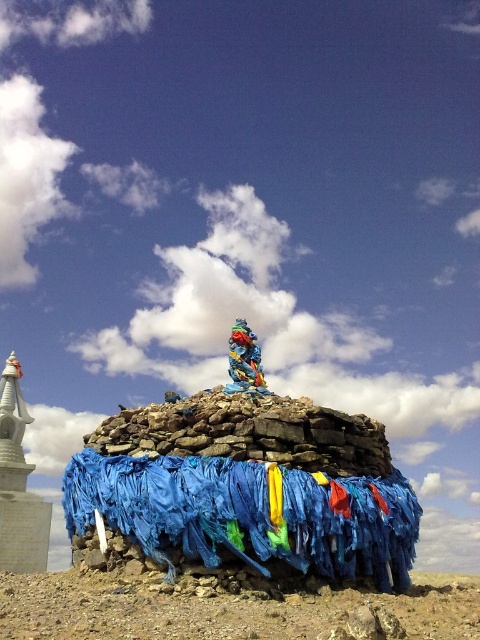
Can you confirm if blue fabric at center is shorter than white glossy stupa at left?

Yes, blue fabric at center is shorter than white glossy stupa at left.

This screenshot has height=640, width=480. Find the location of `blue fabric at center`. blue fabric at center is located at coordinates (248, 513).

Does point (204, 499) lie in front of point (3, 403)?

Yes.

Locate an element on the screen. The image size is (480, 640). blue fabric at center is located at coordinates (248, 513).

Is point (9, 444) more distant than point (233, 365)?

That is True.

Is white glossy stupa at left behind multicolored painted statue at center?

That is True.

Is point (6, 429) closer to viewer compared to point (250, 342)?

That is False.

What are the coordinates of `white glossy stupa at left` in the screenshot? It's located at (12, 413).

Is blue fabric at center smaller than multicolored painted statue at center?

Incorrect, blue fabric at center is not smaller in size than multicolored painted statue at center.

Can you confirm if blue fabric at center is shorter than multicolored painted statue at center?

Incorrect, blue fabric at center's height does not fall short of multicolored painted statue at center's.

Who is more distant from viewer, (129, 522) or (236, 339)?

The point (236, 339) is more distant.

Locate an element on the screen. The image size is (480, 640). blue fabric at center is located at coordinates (248, 513).